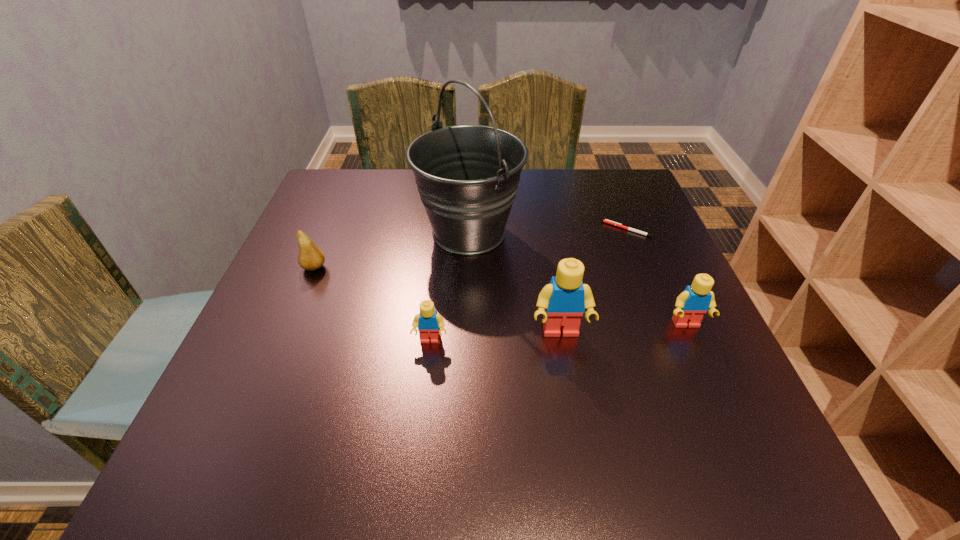
Identify the location of blank area at the far edge. This screenshot has height=540, width=960. click(x=420, y=207).

This screenshot has width=960, height=540. In order to click on blank area at the near edge in this screenshot , I will do `click(436, 417)`.

The image size is (960, 540). Find the location of `vacant space at the left edge of the desktop`. vacant space at the left edge of the desktop is located at coordinates (298, 303).

Where is `vacant region at the right edge of the desktop`? vacant region at the right edge of the desktop is located at coordinates (610, 261).

Where is `free space at the far left corner of the desktop`? The image size is (960, 540). free space at the far left corner of the desktop is located at coordinates (334, 178).

Image resolution: width=960 pixels, height=540 pixels. In the image, there is a desktop. What are the coordinates of `vacant space at the near left corner` in the screenshot? It's located at (296, 412).

Find the location of a particular element. Image resolution: width=960 pixels, height=540 pixels. vacant space at the far right corner of the desktop is located at coordinates (615, 173).

What are the coordinates of `blank space at the near right corner of the desktop` in the screenshot? It's located at (743, 403).

Locate an element on the screen. This screenshot has height=540, width=960. blank region between the shortest object and the second tallest object is located at coordinates (593, 281).

In order to click on free spot between the fifth shortest object and the pear in this screenshot , I will do `click(437, 300)`.